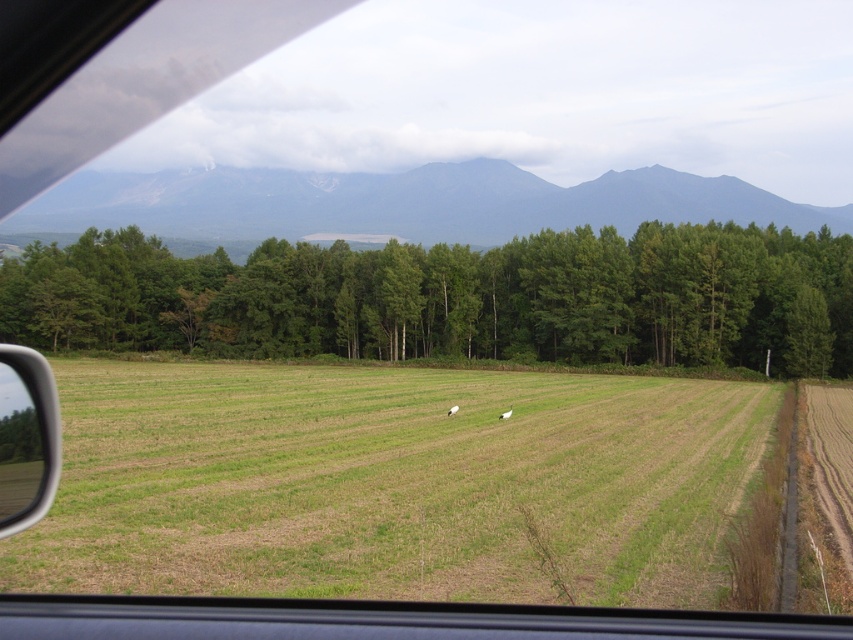
Question: Is grayish-blue mountain at upper center wider than matte plastic side mirror at lower left?

Choices:
 (A) no
 (B) yes

Answer: (B)

Question: Is green grass at center above green leafy trees at center?

Choices:
 (A) no
 (B) yes

Answer: (A)

Question: Which of these objects is positioned closest to the white feathered bird at center?

Choices:
 (A) grayish-blue mountain at upper center
 (B) green grass at center
 (C) green leafy trees at center
 (D) matte plastic side mirror at lower left

Answer: (B)

Question: Which of these objects is positioned closest to the white feathered bird at center?

Choices:
 (A) grayish-blue mountain at upper center
 (B) white woolen sheep at center

Answer: (B)

Question: Which of the following is the farthest from the observer?

Choices:
 (A) (735, 385)
 (B) (456, 412)
 (C) (283, 349)

Answer: (C)

Question: Can you confirm if matte plastic side mirror at lower left is bigger than white feathered bird at center?

Choices:
 (A) no
 (B) yes

Answer: (B)